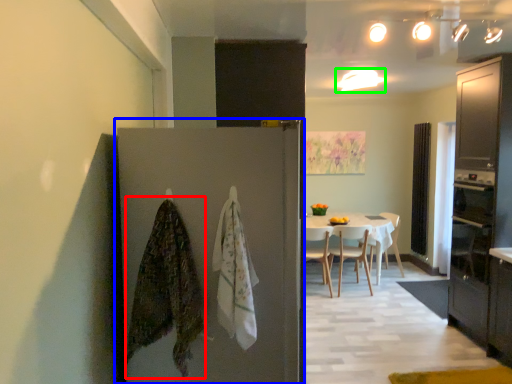
Question: Estimate the real-world distances between objects in this image. Which object is farther from blanket (highlighted by a red box), door (highlighted by a blue box) or lighting (highlighted by a green box)?

Choices:
 (A) door
 (B) lighting

Answer: (B)